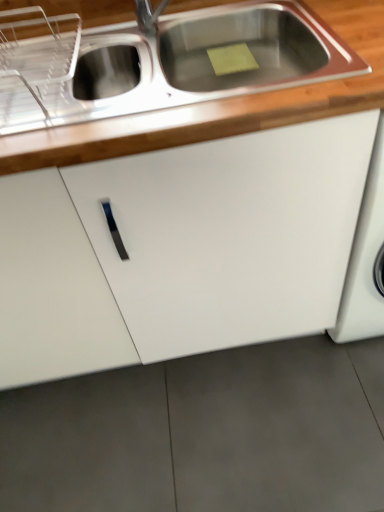
This screenshot has height=512, width=384. What do you see at coordinates (193, 250) in the screenshot?
I see `white matte cabinet at center` at bounding box center [193, 250].

Where is `white matte cabinet at center`? This screenshot has height=512, width=384. white matte cabinet at center is located at coordinates (193, 250).

Measure the distance between white matte cabinet at center and camera.

The depth of white matte cabinet at center is 30.47 inches.

What do you see at coordinates (220, 105) in the screenshot?
I see `wooden countertop at upper center` at bounding box center [220, 105].

Where is `wooden countertop at upper center`? Image resolution: width=384 pixels, height=512 pixels. wooden countertop at upper center is located at coordinates (220, 105).

The height and width of the screenshot is (512, 384). In order to click on white matte cabinet at center in this screenshot , I will do `click(193, 250)`.

Does white matte cabinet at center appear on the right side of wooden countertop at upper center?

No, white matte cabinet at center is not to the right of wooden countertop at upper center.

Consider the image. In the image, is white matte cabinet at center positioned in front of or behind wooden countertop at upper center?

white matte cabinet at center is behind wooden countertop at upper center.

Between point (339, 219) and point (338, 89), which one is positioned behind?

The point (339, 219) is more distant.

From the image's perspective, would you say white matte cabinet at center is positioned over wooden countertop at upper center?

Incorrect, from the image's perspective, white matte cabinet at center is lower than wooden countertop at upper center.

From a real-world perspective, between white matte cabinet at center and wooden countertop at upper center, who is vertically higher?

wooden countertop at upper center, from a real-world perspective.

Is white matte cabinet at center wider or thinner than wooden countertop at upper center?

In the image, white matte cabinet at center appears to be wider than wooden countertop at upper center.

Considering the relative sizes of white matte cabinet at center and wooden countertop at upper center in the image provided, is white matte cabinet at center shorter than wooden countertop at upper center?

Incorrect, the height of white matte cabinet at center does not fall short of that of wooden countertop at upper center.

Looking at the image, does white matte cabinet at center seem bigger or smaller compared to wooden countertop at upper center?

Clearly, white matte cabinet at center is larger in size than wooden countertop at upper center.

Do you think white matte cabinet at center is within wooden countertop at upper center, or outside of it?

white matte cabinet at center is not enclosed by wooden countertop at upper center.

Is white matte cabinet at center next to wooden countertop at upper center?

No, white matte cabinet at center is not next to wooden countertop at upper center.

Is white matte cabinet at center facing away from wooden countertop at upper center?

No, white matte cabinet at center is not facing away from wooden countertop at upper center.

Measure the distance between white matte cabinet at center and wooden countertop at upper center.

A distance of 32.23 centimeters exists between white matte cabinet at center and wooden countertop at upper center.

Where is `countertop above the white matte cabinet at center (from the image's perspective)`? The image size is (384, 512). countertop above the white matte cabinet at center (from the image's perspective) is located at coordinates (220, 105).

Can you confirm if wooden countertop at upper center is positioned to the left of white matte cabinet at center?

No.

Which object is closer to the camera, wooden countertop at upper center or white matte cabinet at center?

Positioned in front is wooden countertop at upper center.

Considering the positions of points (23, 157) and (252, 312), is point (23, 157) farther from camera compared to point (252, 312)?

No.

From the image's perspective, who appears lower, wooden countertop at upper center or white matte cabinet at center?

white matte cabinet at center appears lower in the image.

From a real-world perspective, is wooden countertop at upper center over white matte cabinet at center?

Correct, in the physical world, wooden countertop at upper center is higher than white matte cabinet at center.

Considering the relative sizes of wooden countertop at upper center and white matte cabinet at center in the image provided, is wooden countertop at upper center wider than white matte cabinet at center?

No.

Is wooden countertop at upper center shorter than white matte cabinet at center?

Indeed, wooden countertop at upper center has a lesser height compared to white matte cabinet at center.

Consider the image. Who is bigger, wooden countertop at upper center or white matte cabinet at center?

Bigger between the two is white matte cabinet at center.

Is wooden countertop at upper center completely or partially outside of white matte cabinet at center?

That's incorrect, wooden countertop at upper center is not completely outside white matte cabinet at center.

Is wooden countertop at upper center with white matte cabinet at center?

No, wooden countertop at upper center is not with white matte cabinet at center.

Is wooden countertop at upper center facing away from white matte cabinet at center?

Yes, white matte cabinet at center is at the back of wooden countertop at upper center.

This screenshot has width=384, height=512. Identify the location of cabinetry that is behind the wooden countertop at upper center. (193, 250).

This screenshot has height=512, width=384. What are the coordinates of `countertop above the white matte cabinet at center (from a real-world perspective)` in the screenshot? It's located at (220, 105).

Image resolution: width=384 pixels, height=512 pixels. I want to click on cabinetry located underneath the wooden countertop at upper center (from a real-world perspective), so click(193, 250).